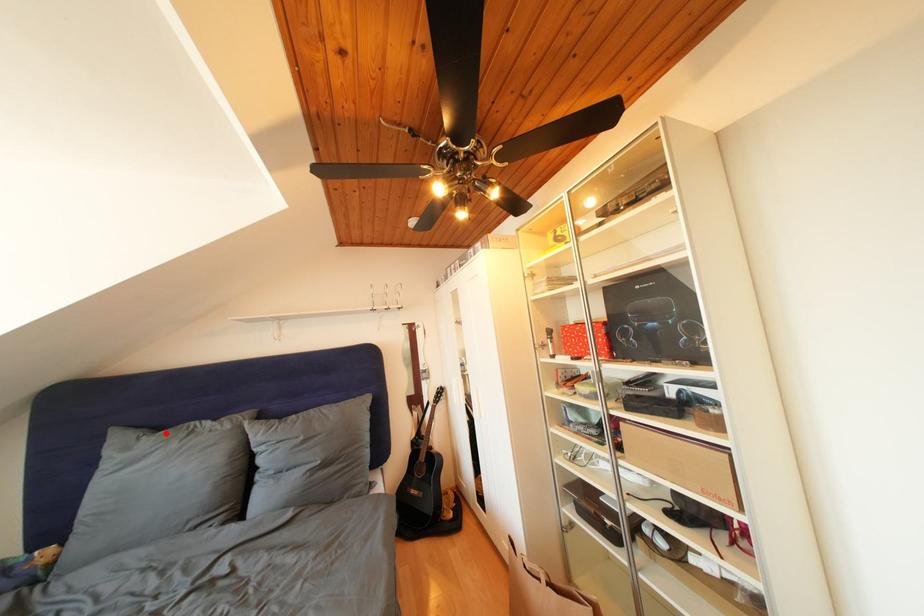
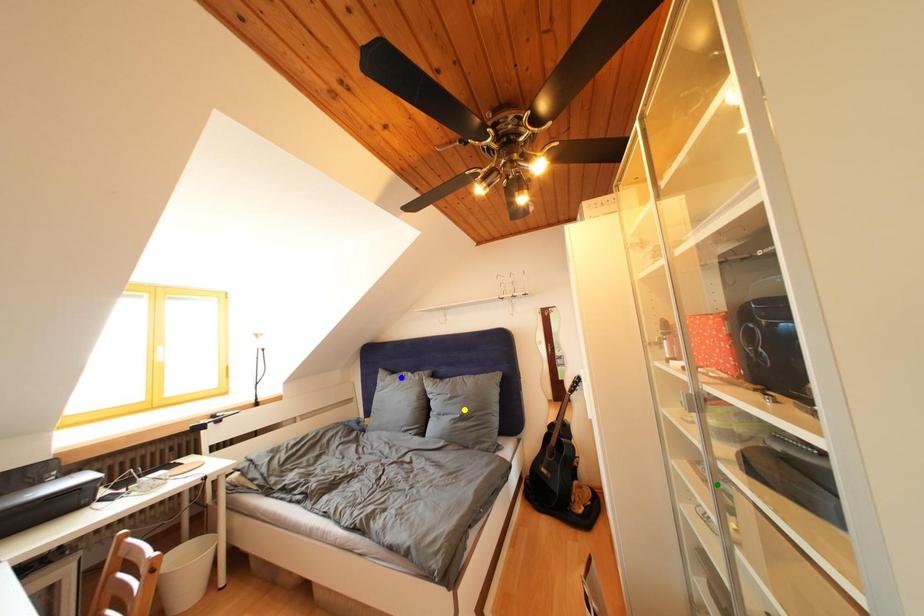
Question: I am providing you with two images of the same scene from different viewpoints. A red point is marked on the first image. You are given multiple points on the second image. Which spot in image 2 lines up with the point in image 1?

Choices:
 (A) yellow point
 (B) blue point
 (C) green point

Answer: (B)